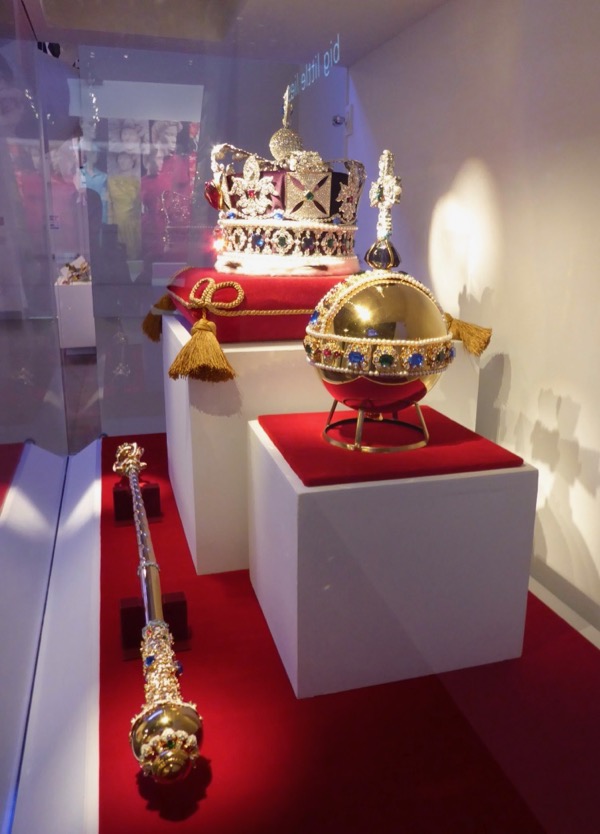
Where is `support stand`? support stand is located at coordinates (153, 493), (179, 613).